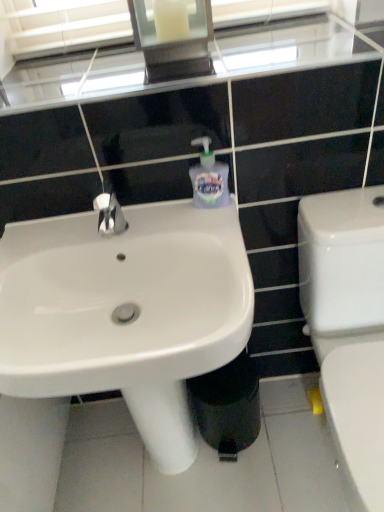
At what (x,y) coordinates should I click in order to perform the action: click on blank area to the left of translucent plastic soap dispenser at center. Please return your answer as a coordinate pair (x, y). The height and width of the screenshot is (512, 384). Looking at the image, I should click on (151, 218).